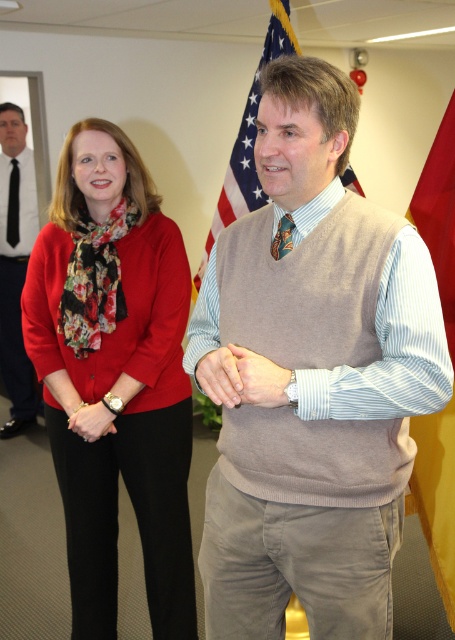
Is light brown sweater vest at center bigger than matte black watch at lower left?

Yes.

Find the location of a particular element. The width and height of the screenshot is (455, 640). light brown sweater vest at center is located at coordinates (317, 385).

The width and height of the screenshot is (455, 640). Identify the location of light brown sweater vest at center. (317, 385).

Does matte black tie at left appear over american flag at center?

Incorrect, matte black tie at left is not positioned above american flag at center.

This screenshot has height=640, width=455. Find the location of `matte black tie at left`. matte black tie at left is located at coordinates (15, 266).

Which is behind, point (86, 412) or point (278, 248)?

Point (86, 412)

Can you confirm if matte black watch at lower left is positioned to the left of shiny blue tie at center?

Correct, you'll find matte black watch at lower left to the left of shiny blue tie at center.

Between point (72, 417) and point (283, 234), which one is positioned behind?

The point (72, 417) is more distant.

You are a GUI agent. You are given a task and a screenshot of the screen. Output one action in this format:
    pyautogui.click(x=<x>, y=<y>)
    Task: Click on the matte black watch at lower left
    The image size is (455, 640).
    Given the screenshot: What is the action you would take?
    (90, 419)